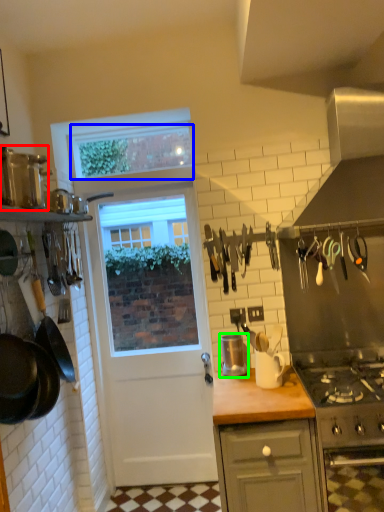
Question: Which object is the closest to the kitchen appliance (highlighted by a red box)? Choose among these: window screen (highlighted by a blue box) or kitchen appliance (highlighted by a green box).

Choices:
 (A) window screen
 (B) kitchen appliance

Answer: (A)